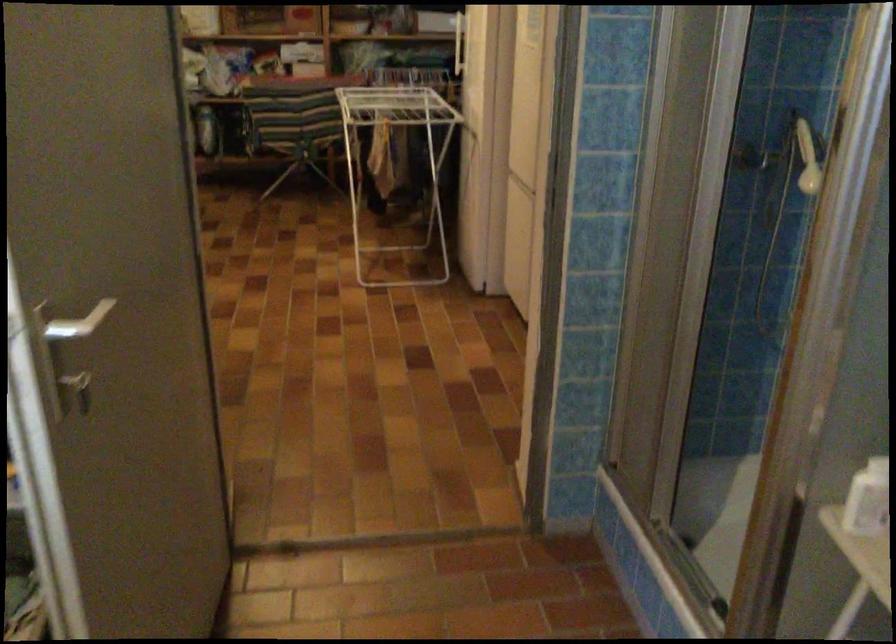
I want to click on silver door handle, so click(x=80, y=322).